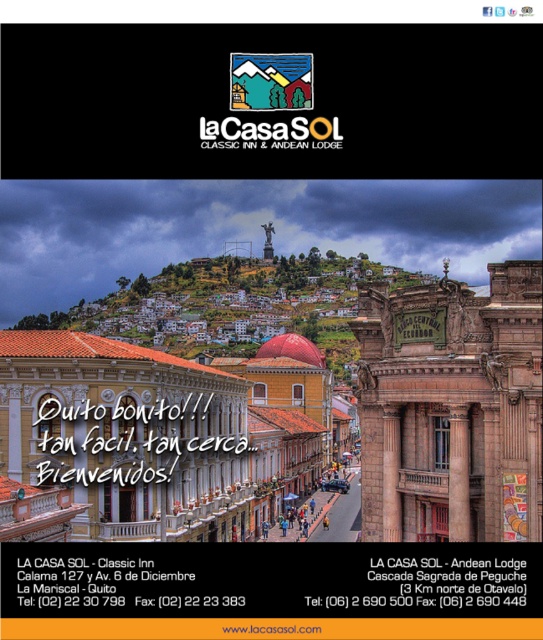
Is brown stone building at center closer to camera compared to brown stone column at center?

Yes.

Can you confirm if brown stone building at center is positioned to the left of brown stone column at center?

Result: Indeed, brown stone building at center is positioned on the left side of brown stone column at center.

The height and width of the screenshot is (640, 543). What do you see at coordinates (451, 403) in the screenshot?
I see `brown stone building at center` at bounding box center [451, 403].

This screenshot has width=543, height=640. I want to click on brown stone building at center, so click(x=451, y=403).

Does brown stone building at center come behind multicolored wooden house at upper center?

That is False.

Is point (148, 536) less distant than point (236, 108)?

Yes, point (148, 536) is closer to viewer.

Locate an element on the screen. Image resolution: width=543 pixels, height=640 pixels. brown stone building at center is located at coordinates (451, 403).

Is multicolored wooden house at upper center further to camera compared to brown stone column at center?

Yes.

Can you confirm if multicolored wooden house at upper center is positioned to the left of brown stone column at center?

Yes, multicolored wooden house at upper center is to the left of brown stone column at center.

Between point (274, 83) and point (459, 524), which one is positioned in front?

Point (459, 524)

Identify the location of multicolored wooden house at upper center. Image resolution: width=543 pixels, height=640 pixels. point(270,81).